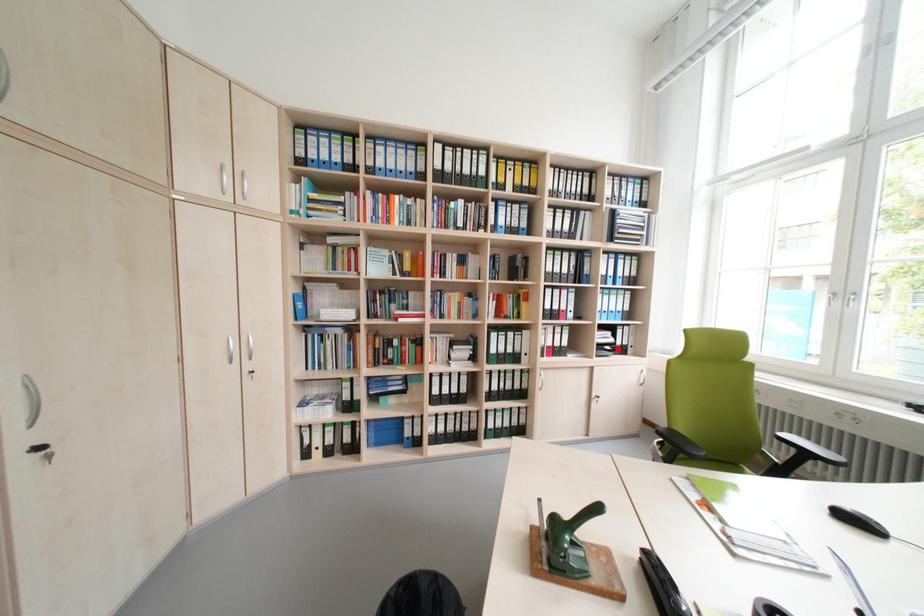
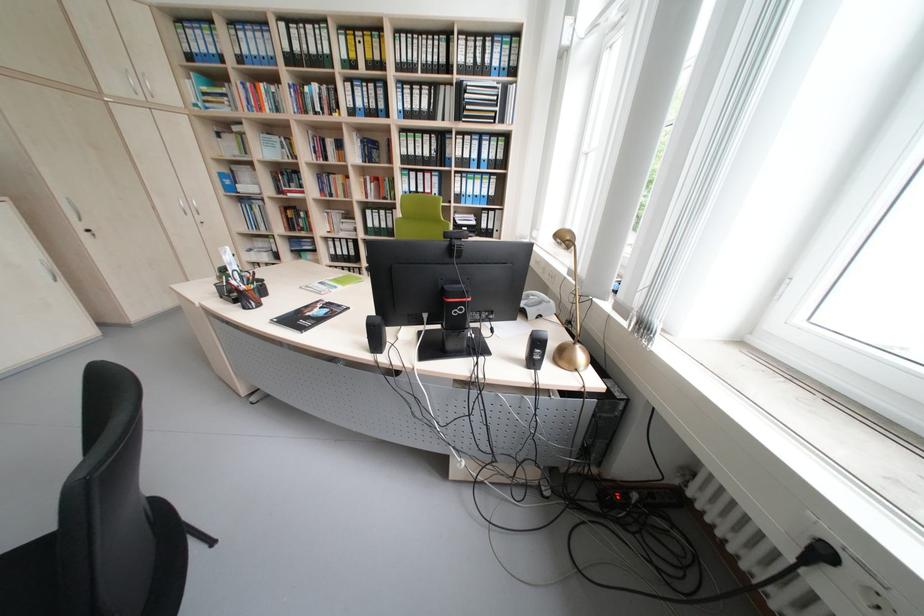
Question: A red point is marked in image1. In image2, is the corresponding 3D point closer to the camera or farther? Reply with the corresponding letter.

Choices:
 (A) The corresponding 3D point is closer.
 (B) The corresponding 3D point is farther.

Answer: (B)